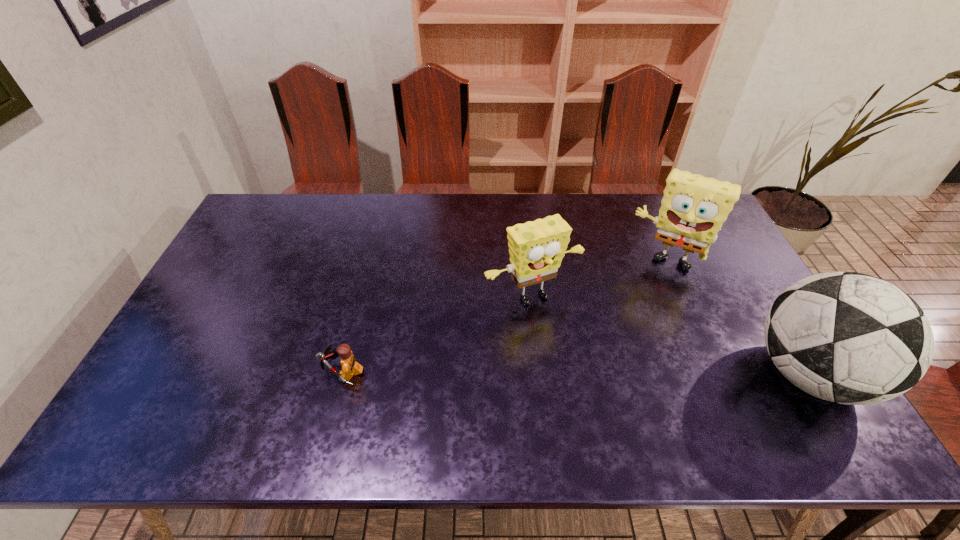
Image resolution: width=960 pixels, height=540 pixels. Identify the location of the leftmost object. (350, 367).

Where is `Lego`? The width and height of the screenshot is (960, 540). Lego is located at coordinates (350, 367).

Identify the location of soccer ball. point(846,337).

In order to click on the third nearest object in this screenshot , I will do `click(536, 248)`.

You are a GUI agent. You are given a task and a screenshot of the screen. Output one action in this format:
    pyautogui.click(x=<x>, y=<y>)
    Task: Click on the nearer sponge
    This screenshot has width=960, height=540.
    Given the screenshot: What is the action you would take?
    pyautogui.click(x=536, y=248)

You are a GUI agent. You are given a task and a screenshot of the screen. Output one action in this format:
    pyautogui.click(x=<x>, y=<y>)
    Task: Click on the farthest object
    This screenshot has width=960, height=540.
    Given the screenshot: What is the action you would take?
    pyautogui.click(x=694, y=207)

Find the location of a particular element. the right sponge is located at coordinates (694, 207).

Where is `vacant position located holding a crossbow in the hands of the leftmost object`? vacant position located holding a crossbow in the hands of the leftmost object is located at coordinates (231, 373).

This screenshot has height=540, width=960. I want to click on free location located 0.260m holding a crossbow in the hands of the leftmost object, so 220,373.

Identify the location of vacant space positioned 0.160m holding a crossbow in the hands of the leftmost object. (259, 373).